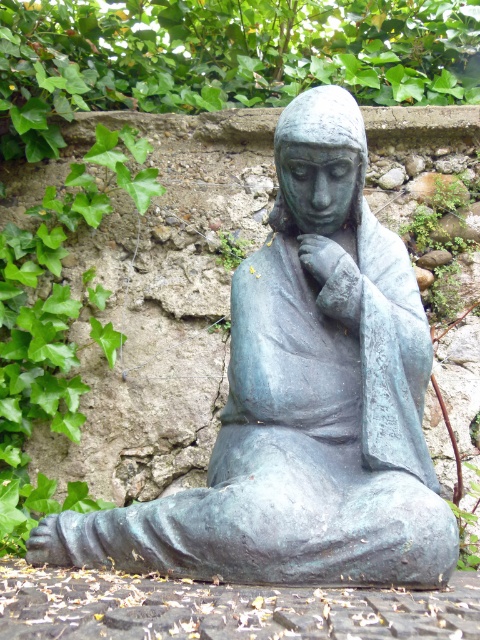
You are standing at the origin point in the image. The bronze statue at center is placed at coordinates 0.631 on both the x and y axes. If you want to walk directly towards the statue, which direction should you move?

A: Since the bronze statue at center is located at coordinates 0.631 on both the x and y axes, you should move northeast to reach it directly.

You are a sculptor who wants to place a small plaque between the bronze statue at center and the bronze textured hand at center. The plaque is 12 inches wide. Is there enough space between them to fit the plaque?

The bronze statue at center and bronze textured hand at center are 19.37 inches apart from each other. Since the plaque is 12 inches wide, there is enough space between them to fit the plaque.